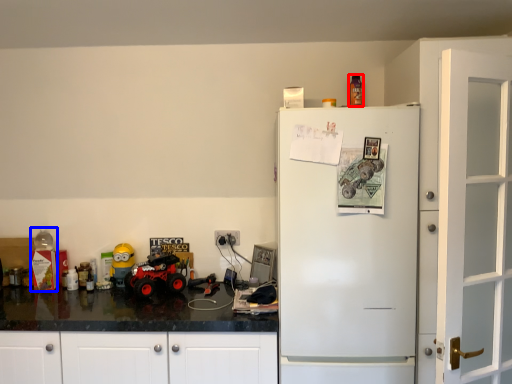
Question: Which point is further to the camera, toy (highlighted by a red box) or toy (highlighted by a blue box)?

Choices:
 (A) toy
 (B) toy

Answer: (B)